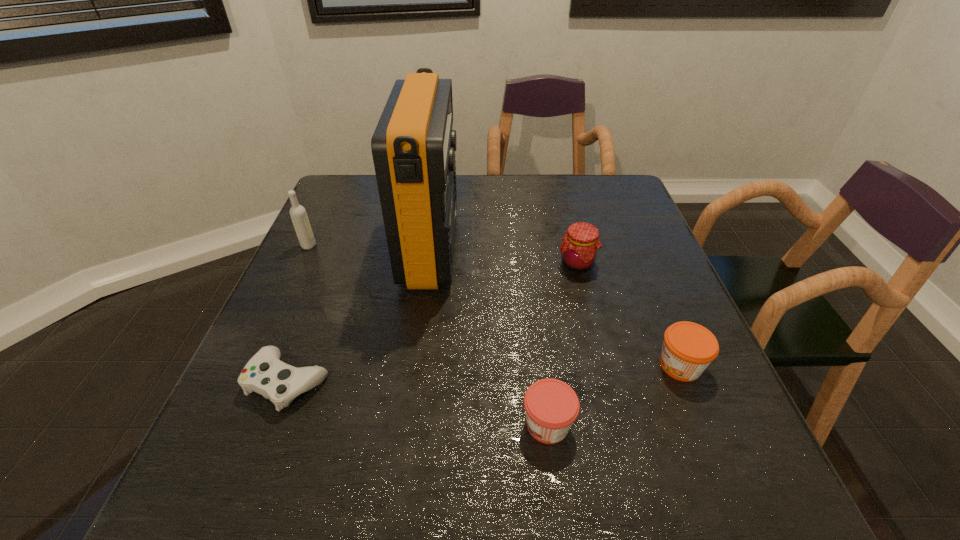
This screenshot has height=540, width=960. I want to click on vacant space located on the front-facing side of the tallest object, so click(x=522, y=248).

Find the location of `free spot located on the front of the vodka`. free spot located on the front of the vodka is located at coordinates (292, 282).

Where is `free point located on the back of the fourth shortest object`? The image size is (960, 540). free point located on the back of the fourth shortest object is located at coordinates (564, 211).

You are a GUI agent. You are given a task and a screenshot of the screen. Output one action in this format:
    pyautogui.click(x=<x>, y=<y>)
    Task: Click on the free region located 0.070m on the front label of the rightmost object
    Image resolution: width=960 pixels, height=540 pixels.
    Given the screenshot: What is the action you would take?
    pyautogui.click(x=620, y=365)

You are a GUI agent. You are given a task and a screenshot of the screen. Output one action in this format:
    pyautogui.click(x=<x>, y=<y>)
    Task: Click on the vacant area situated on the front label of the rightmost object
    
    Given the screenshot: What is the action you would take?
    pyautogui.click(x=549, y=365)

Find the location of a particular element. The image size is (960, 540). free spot located on the front label of the rightmost object is located at coordinates tap(549, 365).

Where is `free space located on the front label of the leftmost jam`? This screenshot has height=540, width=960. free space located on the front label of the leftmost jam is located at coordinates (356, 424).

Where is `vacant space situated on the front label of the leftmost jam`? The height and width of the screenshot is (540, 960). vacant space situated on the front label of the leftmost jam is located at coordinates [328, 424].

Find the location of a particular element. This screenshot has height=540, width=960. free space located 0.250m on the front label of the leftmost jam is located at coordinates (379, 424).

Locate an element on the screen. vacant space located on the back of the shortest object is located at coordinates (337, 253).